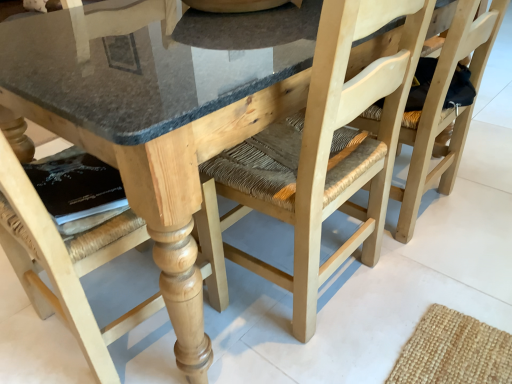
This screenshot has height=384, width=512. I want to click on vacant area in front of natural wood chair at center, the first chair positioned from the right, so click(448, 275).